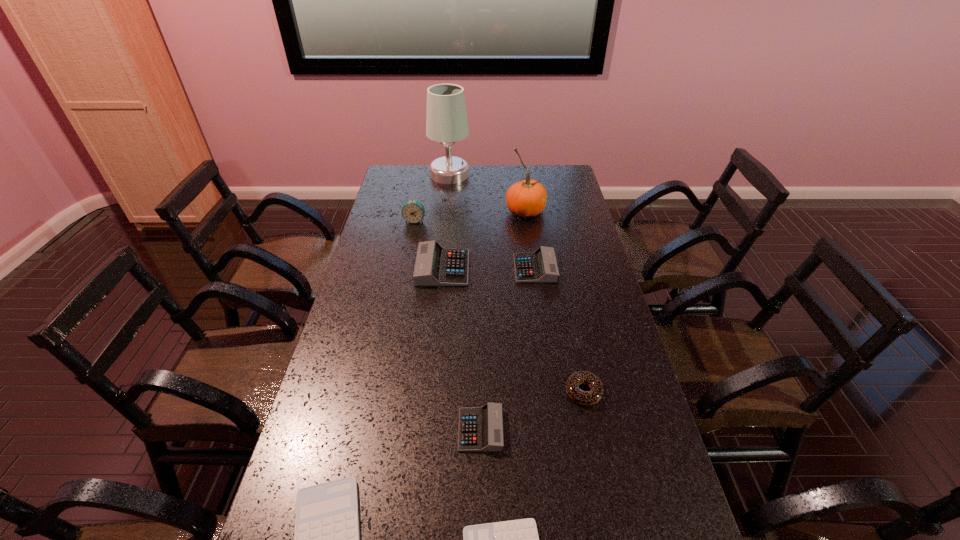
Where is `vacant area between the alarm clock and the second tallest object`? Image resolution: width=960 pixels, height=540 pixels. vacant area between the alarm clock and the second tallest object is located at coordinates (470, 216).

You are a GUI agent. You are given a task and a screenshot of the screen. Output one action in this format:
    pyautogui.click(x=<x>, y=<y>)
    Task: Click on the empty space between the fourth shortest calculator and the biggest gray calculator
    The width and height of the screenshot is (960, 540).
    Given the screenshot: What is the action you would take?
    pyautogui.click(x=489, y=268)

The width and height of the screenshot is (960, 540). Identify the location of vacant area that lies between the tallest object and the biggest gray calculator. (446, 221).

Find the location of a particular element. free space between the eighth shortest object and the nearest gray calculator is located at coordinates (503, 321).

Identify the location of object that is the eighth closest to the second tallest calculator. (326, 539).

The height and width of the screenshot is (540, 960). I want to click on the fourth closest object to the alarm clock, so click(x=540, y=266).

Locate which calculator is the second closest to the tallest calculator. Please provide its 2D coordinates. Your answer should be formatted as a tuple, i.e. [(x, y)], where the tuple contains the x and y coordinates of a point satisfying the conditions above.

[(480, 429)]

Select which calculator is the closest to the eighth tallest object. Please provide its 2D coordinates. Your answer should be formatted as a tuple, i.e. [(x, y)], where the tuple contains the x and y coordinates of a point satisfying the conditions above.

[(480, 429)]

I want to click on gray calculator that stands as the second closest to the orange pumpkin, so click(x=435, y=266).

Identify which gray calculator is located as the second nearest to the doughnut. Please provide its 2D coordinates. Your answer should be formatted as a tuple, i.e. [(x, y)], where the tuple contains the x and y coordinates of a point satisfying the conditions above.

[(540, 266)]